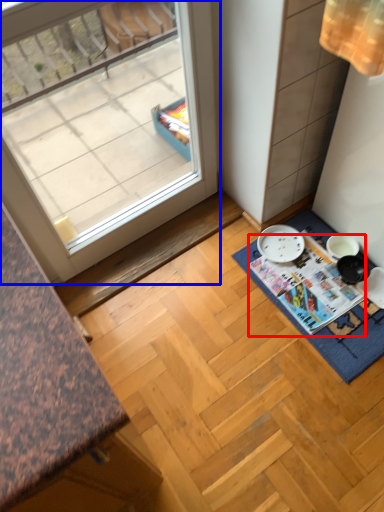
Question: Among these objects, which one is nearest to the camera, magazine (highlighted by a red box) or window (highlighted by a blue box)?

Choices:
 (A) magazine
 (B) window

Answer: (B)